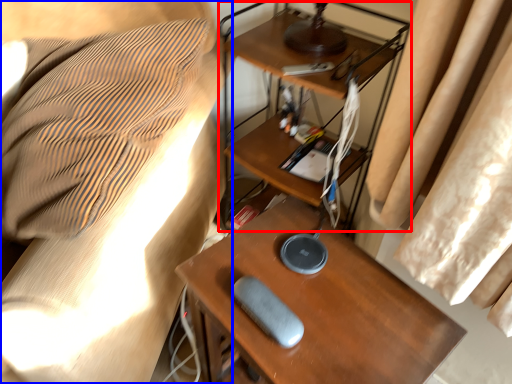
Question: Among these objects, which one is nearest to the camera, computer desk (highlighted by a red box) or furniture (highlighted by a blue box)?

Choices:
 (A) computer desk
 (B) furniture

Answer: (B)